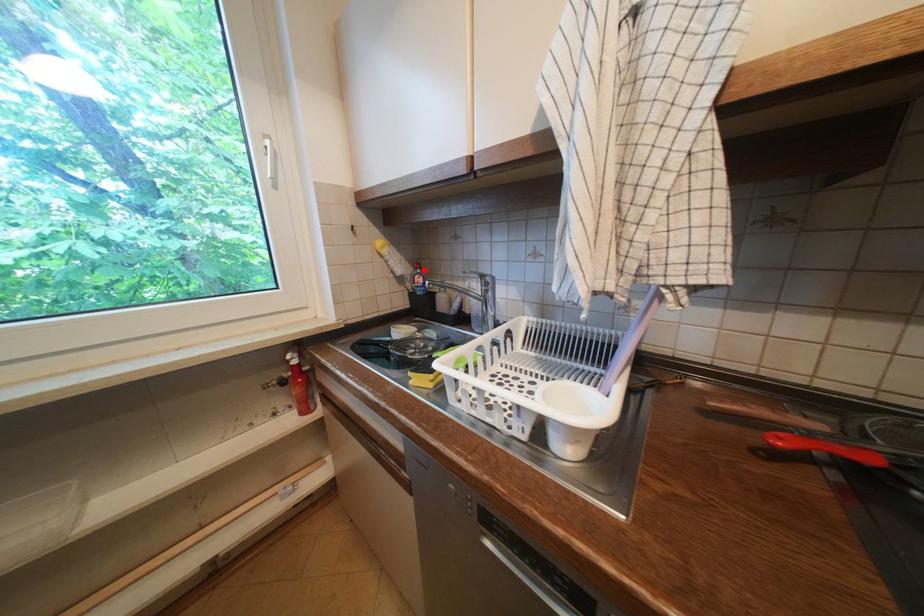
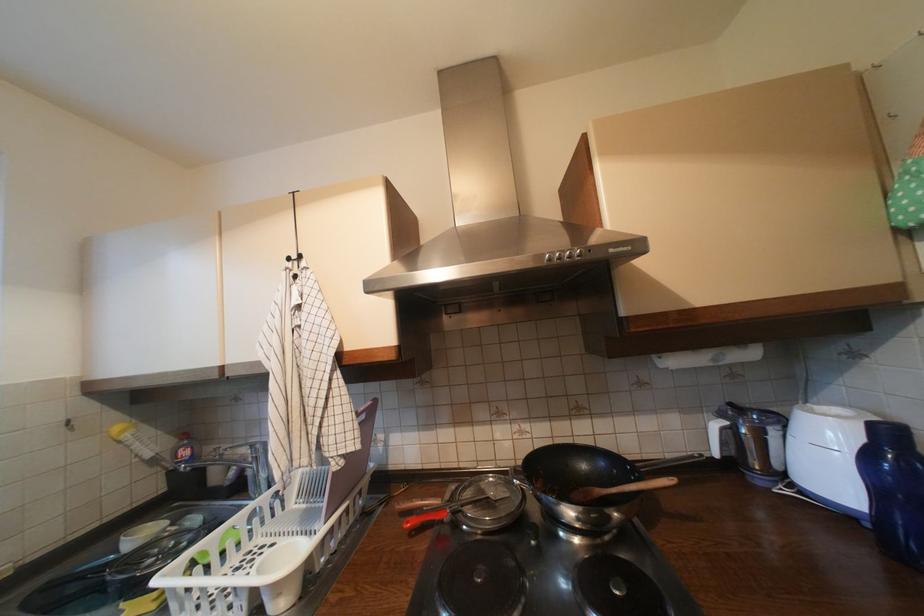
Find the pixel in the second image that matches the highlighted location in the first image.

(189, 440)